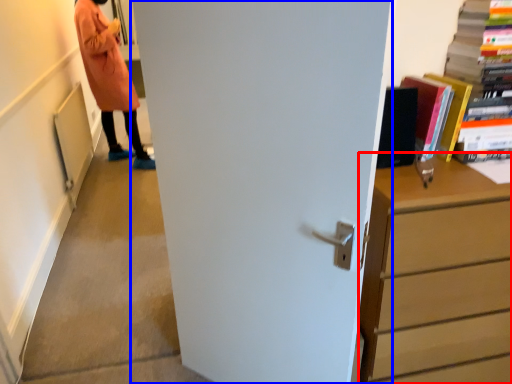
Question: Among these objects, which one is nearest to the camera, chest of drawers (highlighted by a red box) or door (highlighted by a blue box)?

Choices:
 (A) chest of drawers
 (B) door

Answer: (B)